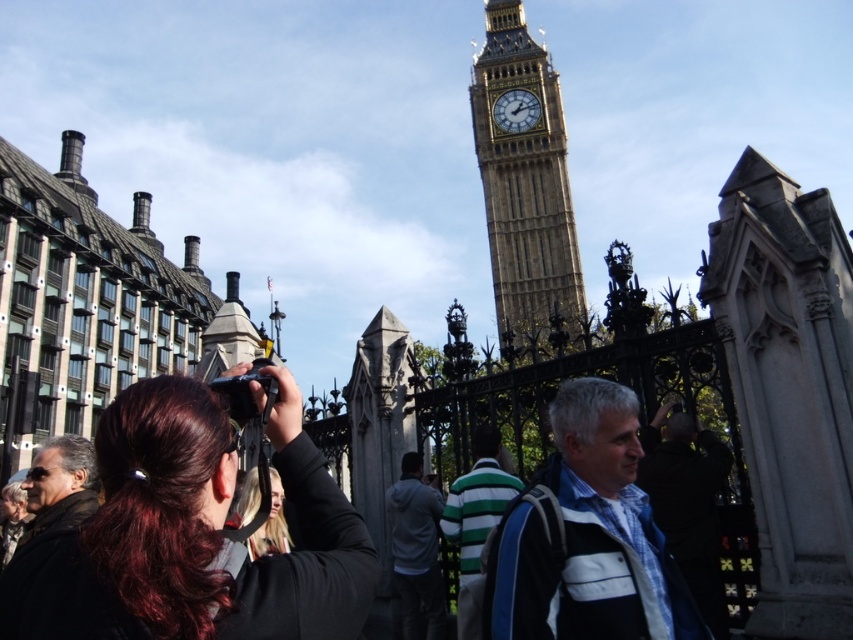
You are standing in front of Big Ben and notice two people wearing striped shirts at the center of the scene. Which one is higher positioned between the blue striped shirt at center and the green striped shirt at center?

The blue striped shirt at center is above the green striped shirt at center, so it is higher positioned.

You are standing in the tourist location near Big Ben. You see the stone clock tower at center and the gray hoodie at center. Which object is higher in the image?

The stone clock tower at center is located above the gray hoodie at center, so it is higher in the image.

You are a photographer trying to capture a clear shot of Big Ben. There are two people in the way, a gray hoodie at center and a blonde hair at center. Which person should you move to get a better view?

The gray hoodie at center is positioned under blonde hair at center, so you should move the person with the gray hoodie at center first to get a better view of Big Ben.